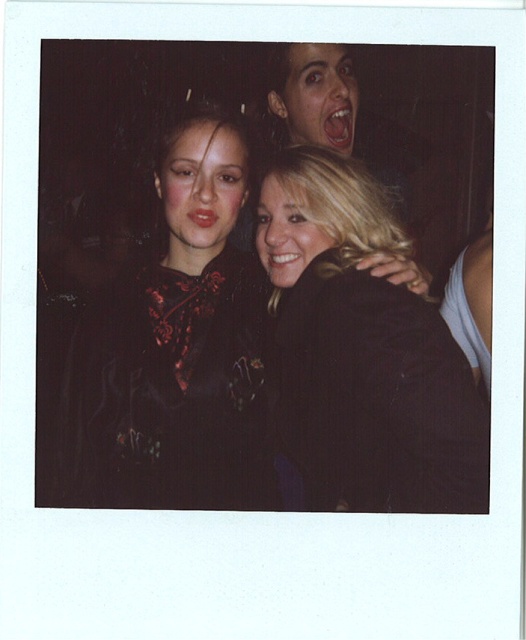
You are trying to locate the black textured jacket at center in the Polaroid photograph. Based on the coordinates provided in the Objects Description, can you determine its position relative to the two women?

The black textured jacket at center is positioned at coordinates point (259, 300), which places it centrally in the image between the two women featured in the foreground.

You are organizing a charity event and need to display these two items from the image, the black textured jacket at center and the matte black blouse at center, on a display stand. The stand can only accommodate items up to 40 cm in width. Based on the image, will both items fit on the stand?

The black textured jacket at center is wider than the matte black blouse at center. Since the stand can only hold items up to 40 cm, we need to check each item individually. However, the description only states their relative sizes, not exact measurements. Without specific width details for either item, we cannot confirm if both will fit on the stand.